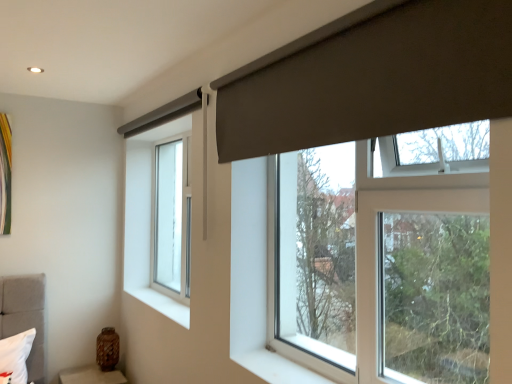
Question: Is clear glass window at center left, positioned as the 2th window in right-to-left order, located outside transparent glass window at center, the 1th window viewed from the front?

Choices:
 (A) yes
 (B) no

Answer: (A)

Question: From the image's perspective, would you say clear glass window at center left, which is the 1th window in left-to-right order, is shown under transparent glass window at center, acting as the second window starting from the left?

Choices:
 (A) no
 (B) yes

Answer: (A)

Question: Could you tell me if clear glass window at center left, which is the 1th window in left-to-right order, is turned towards transparent glass window at center, which is counted as the first window, starting from the right?

Choices:
 (A) yes
 (B) no

Answer: (B)

Question: Considering the relative positions of clear glass window at center left, positioned as the 2th window in right-to-left order, and transparent glass window at center, acting as the second window starting from the left, in the image provided, is clear glass window at center left, positioned as the 2th window in right-to-left order, to the left of transparent glass window at center, acting as the second window starting from the left, from the viewer's perspective?

Choices:
 (A) no
 (B) yes

Answer: (B)

Question: From the image's perspective, would you say clear glass window at center left, positioned as the 2th window in right-to-left order, is positioned over transparent glass window at center, acting as the second window starting from the left?

Choices:
 (A) no
 (B) yes

Answer: (B)

Question: Is transparent glass window at center, which is counted as the first window, starting from the right, inside clear glass window at center left, the 2th window positioned from the front?

Choices:
 (A) no
 (B) yes

Answer: (A)

Question: From a real-world perspective, is clear glass window at center left, which is the 1th window in left-to-right order, on white smooth window sill at lower left?

Choices:
 (A) yes
 (B) no

Answer: (A)

Question: Is clear glass window at center left, which appears as the first window when viewed from the back, to the right of white smooth window sill at lower left from the viewer's perspective?

Choices:
 (A) yes
 (B) no

Answer: (A)

Question: Is clear glass window at center left, which appears as the first window when viewed from the back, not within white smooth window sill at lower left?

Choices:
 (A) no
 (B) yes

Answer: (B)

Question: Does clear glass window at center left, which appears as the first window when viewed from the back, appear on the left side of white smooth window sill at lower left?

Choices:
 (A) yes
 (B) no

Answer: (B)

Question: From the image's perspective, is clear glass window at center left, the 2th window positioned from the front, located beneath white smooth window sill at lower left?

Choices:
 (A) no
 (B) yes

Answer: (A)

Question: Does clear glass window at center left, which appears as the first window when viewed from the back, have a smaller size compared to white smooth window sill at lower left?

Choices:
 (A) yes
 (B) no

Answer: (B)

Question: From a real-world perspective, is brown textured vase at lower left positioned over white smooth window sill at lower left based on gravity?

Choices:
 (A) no
 (B) yes

Answer: (A)